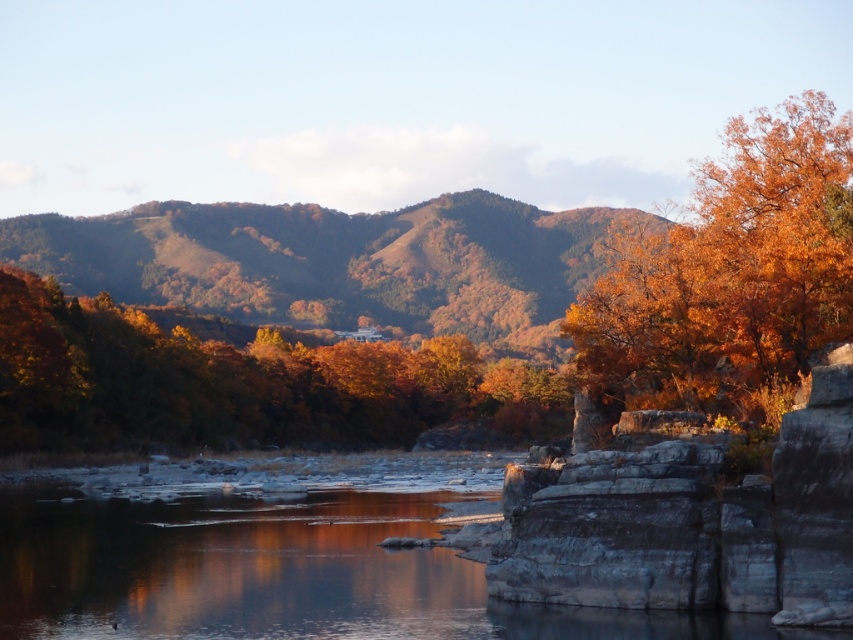
Who is more distant from viewer, (825, 116) or (509, 547)?

The point (825, 116) is behind.

Describe the element at coordinates (432, 308) in the screenshot. The image size is (853, 640). I see `golden foliage at center` at that location.

The height and width of the screenshot is (640, 853). I want to click on golden foliage at center, so click(x=432, y=308).

Is golden foliage tree at center above golden textured tree at right?

Actually, golden foliage tree at center is below golden textured tree at right.

Can you confirm if golden foliage tree at center is positioned below golden textured tree at right?

Correct, golden foliage tree at center is located below golden textured tree at right.

Measure the distance between golden foliage tree at center and camera.

A distance of 144.92 meters exists between golden foliage tree at center and camera.

Identify the location of golden foliage tree at center. (236, 381).

Is golden foliage at center closer to camera compared to golden textured tree at right?

No.

Does golden foliage at center have a smaller size compared to golden textured tree at right?

Incorrect, golden foliage at center is not smaller in size than golden textured tree at right.

Find the location of a particular element. The height and width of the screenshot is (640, 853). golden foliage at center is located at coordinates (432, 308).